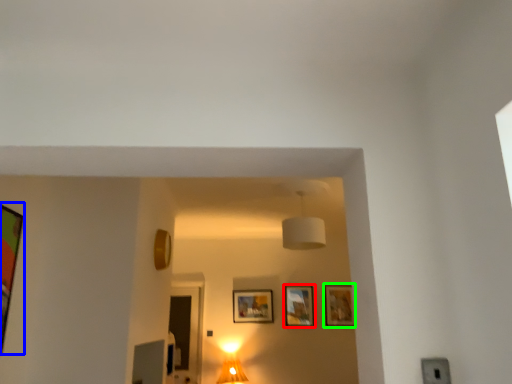
Question: Which is nearer to the picture frame (highlighted by a red box)? picture frame (highlighted by a blue box) or picture frame (highlighted by a green box).

Choices:
 (A) picture frame
 (B) picture frame

Answer: (B)